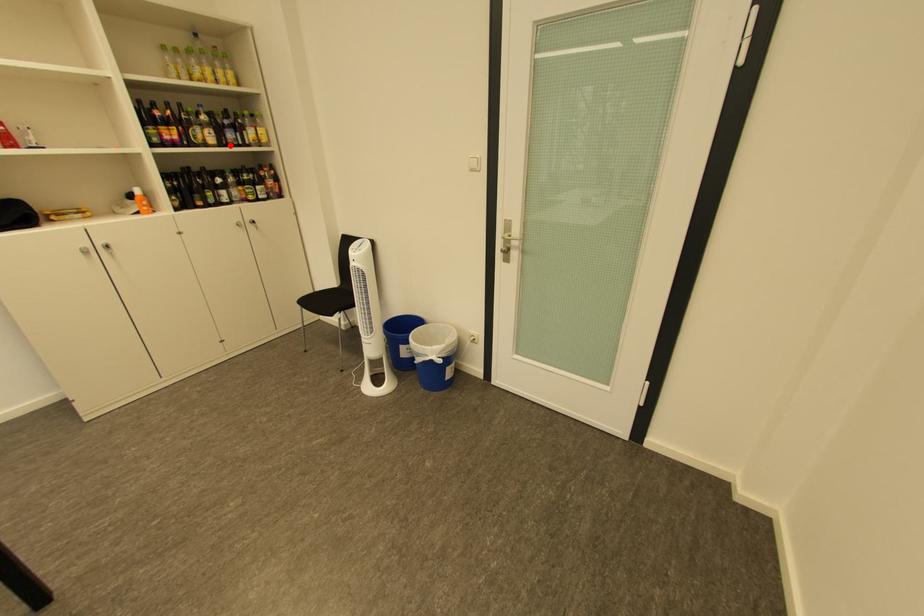
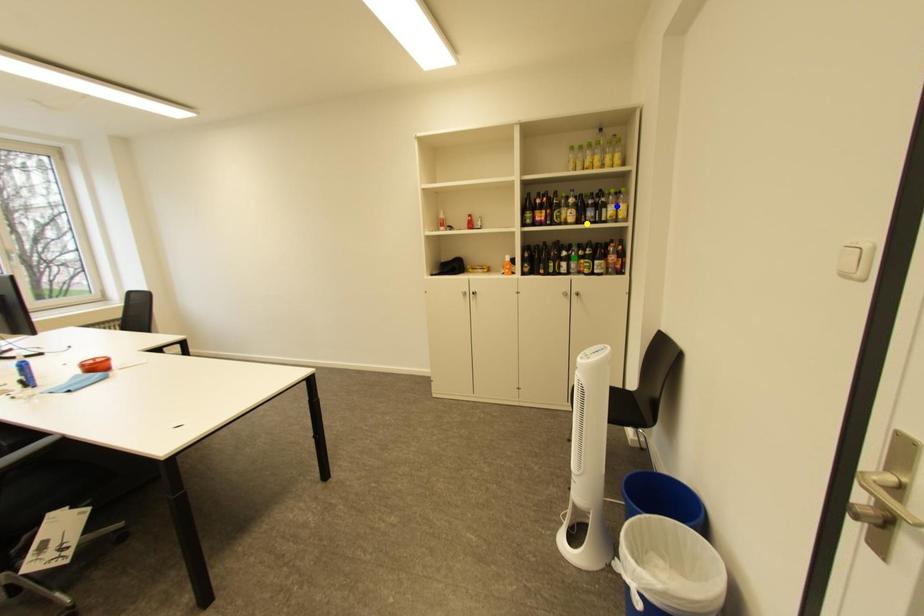
Question: I am providing you with two images of the same scene from different viewpoints. A red point is marked on the first image. You are given multiple points on the second image. Which point in image 2 represents the same 3d spot as the red point in image 1?

Choices:
 (A) green point
 (B) yellow point
 (C) blue point

Answer: (B)